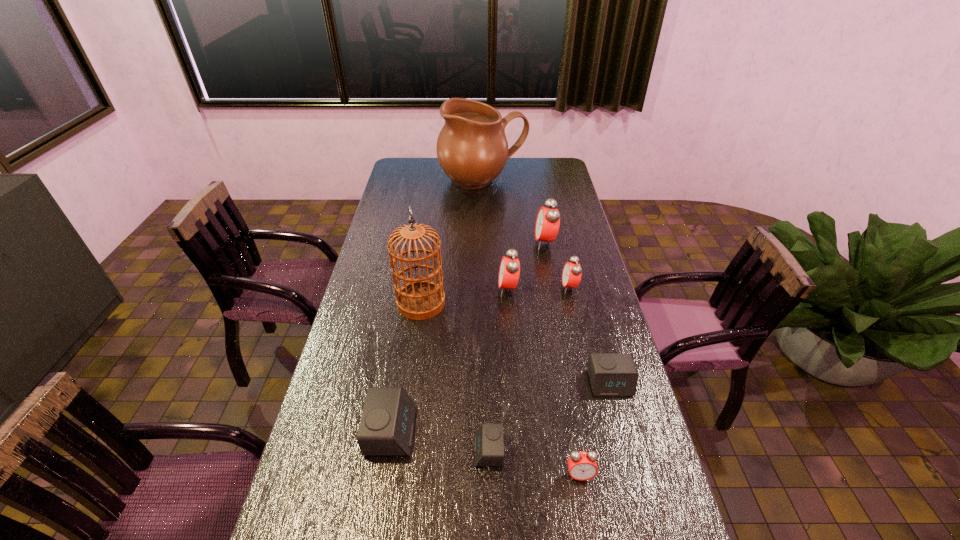
The height and width of the screenshot is (540, 960). I want to click on cream pitcher, so point(472,149).

Image resolution: width=960 pixels, height=540 pixels. In order to click on brown cream pitcher in this screenshot , I will do `click(472, 149)`.

Identify the location of birdcage. (420, 299).

Find the location of a particular element. the second farthest object is located at coordinates (547, 224).

Image resolution: width=960 pixels, height=540 pixels. What are the coordinates of `the tallest alarm clock` in the screenshot? It's located at (547, 224).

At what (x,y) coordinates should I click in order to perform the action: click on the third alarm clock from left to right. Please return your answer as a coordinate pair (x, y). Looking at the image, I should click on point(509,271).

Image resolution: width=960 pixels, height=540 pixels. I want to click on the sixth shortest object, so click(x=509, y=271).

Image resolution: width=960 pixels, height=540 pixels. In order to click on the fifth shortest object in this screenshot , I will do `click(571, 275)`.

In order to click on the third tallest alarm clock in this screenshot , I will do `click(571, 275)`.

The width and height of the screenshot is (960, 540). Identify the location of the leftmost alarm clock. (386, 428).